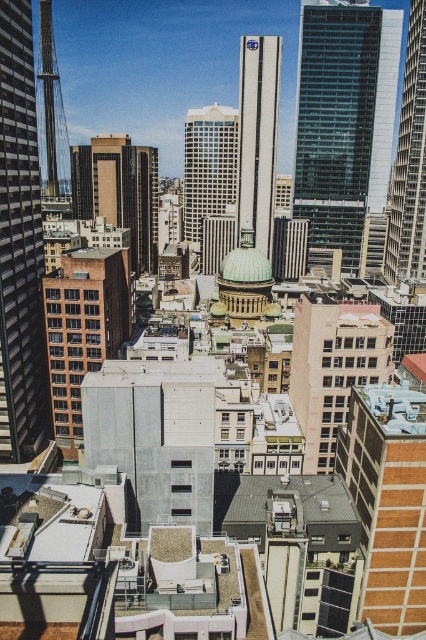
Question: Which point is closer to the camera?

Choices:
 (A) smooth glass skyscraper at center
 (B) glassy steel skyscraper at center
 (C) transparent glass skyscraper at center

Answer: (A)

Question: Is glassy steel skyscraper at left below smooth glass skyscraper at center?

Choices:
 (A) no
 (B) yes

Answer: (B)

Question: Is glassy steel skyscraper at left bigger than brown brick building at center-right?

Choices:
 (A) yes
 (B) no

Answer: (A)

Question: Can you confirm if glassy steel skyscraper at left is thinner than smooth glass skyscraper at center?

Choices:
 (A) yes
 (B) no

Answer: (A)

Question: Which object is farther from the camera taking this photo?

Choices:
 (A) transparent glass skyscraper at center
 (B) brown brick building at center

Answer: (A)

Question: Which point is closer to the camera taking this photo?

Choices:
 (A) (242, 61)
 (B) (34, 380)

Answer: (B)